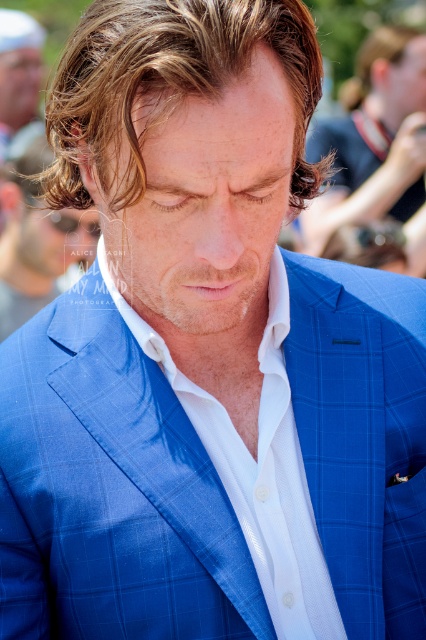
Question: Which point is farther to the camera?

Choices:
 (A) white textured shirt at center
 (B) golden brown hair at center
 (C) brown wavy hair at upper right
 (D) brown smooth hair at center

Answer: (C)

Question: Does golden brown hair at center appear on the right side of brown smooth hair at center?

Choices:
 (A) no
 (B) yes

Answer: (A)

Question: Can you confirm if white textured shirt at center is bigger than brown smooth hair at center?

Choices:
 (A) yes
 (B) no

Answer: (B)

Question: Which point is farther to the camera?

Choices:
 (A) (x=134, y=26)
 (B) (x=365, y=221)
 (C) (x=298, y=566)
 (D) (x=339, y=189)

Answer: (D)

Question: Estimate the real-world distances between objects in this image. Which object is closer to the brown smooth hair at center?

Choices:
 (A) white textured shirt at center
 (B) brown wavy hair at upper right
 (C) golden brown hair at center
 (D) blue checkered suit at center

Answer: (D)

Question: Can you confirm if golden brown hair at center is smaller than brown smooth hair at center?

Choices:
 (A) no
 (B) yes

Answer: (A)